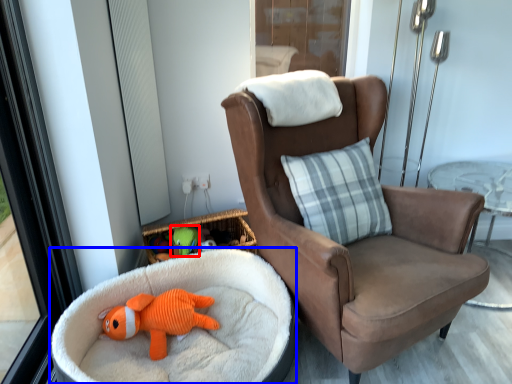
Question: Which object is closer to the camera taking this photo, toy (highlighted by a red box) or dog bed (highlighted by a blue box)?

Choices:
 (A) toy
 (B) dog bed

Answer: (B)